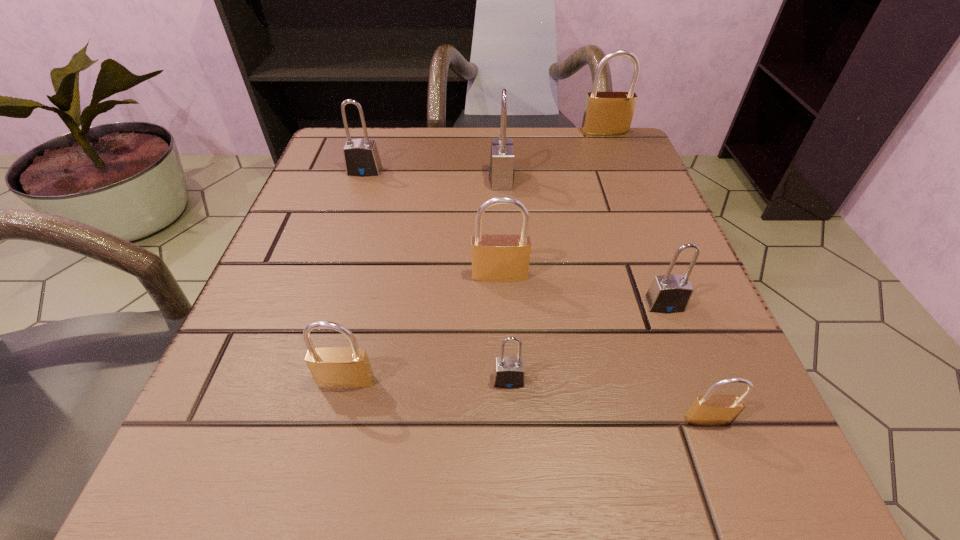
The height and width of the screenshot is (540, 960). In order to click on vacant area situated on the front-facing side of the third biggest brass padlock in this screenshot , I will do `click(323, 479)`.

This screenshot has height=540, width=960. I want to click on free space located on the shackle of the nearest gray padlock, so click(x=511, y=427).

Find the location of `vacant space located 0.050m on the front-facing side of the nearest padlock`. vacant space located 0.050m on the front-facing side of the nearest padlock is located at coordinates (727, 469).

Where is `object that is at the far left corner`? object that is at the far left corner is located at coordinates (361, 157).

Locate an element on the screen. The width and height of the screenshot is (960, 540). object present at the far right corner is located at coordinates (606, 113).

The width and height of the screenshot is (960, 540). In order to click on free region at the far edge in this screenshot , I will do `click(464, 181)`.

In the image, there is a desktop. Identify the location of vacant space at the left edge. (323, 252).

Locate an element on the screen. The width and height of the screenshot is (960, 540). free space at the right edge of the desktop is located at coordinates (691, 301).

The width and height of the screenshot is (960, 540). I want to click on free region at the far left corner, so click(382, 170).

Image resolution: width=960 pixels, height=540 pixels. What are the coordinates of `vacant space at the near left corner of the desktop` in the screenshot? It's located at (255, 513).